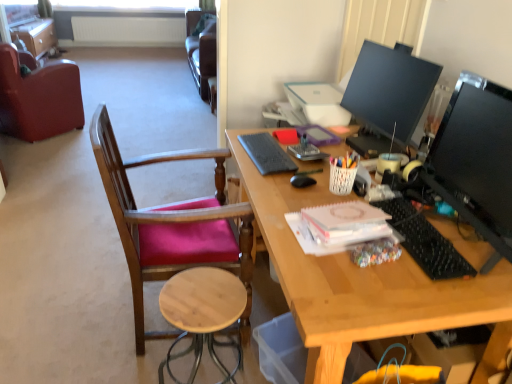
Question: From the image's perspective, is pink paper notepad at center, arranged as the 1th notepad when ordered from the bottom, located above or below matte brown file cabinet at upper left?

Choices:
 (A) above
 (B) below

Answer: (B)

Question: From a real-world perspective, is pink paper notepad at center, placed as the 1th notepad when sorted from front to back, positioned above or below matte brown file cabinet at upper left?

Choices:
 (A) below
 (B) above

Answer: (B)

Question: Which object is positioned closest to the gray matte keyboard at center, the first notepad in the top-to-bottom sequence?

Choices:
 (A) natural wood stool at lower center
 (B) black glossy monitor at right, marked as the 2th television in a back-to-front arrangement
 (C) matte black monitor at upper right, which is counted as the first television, starting from the back
 (D) leather at left, the second chair in the right-to-left sequence
 (E) matte brown file cabinet at upper left

Answer: (C)

Question: Which object is positioned farthest from the leather at left, which is the 1th chair in top-to-bottom order?

Choices:
 (A) pink paper notepad at center, which ranks as the 2th notepad in top-to-bottom order
 (B) gray matte keyboard at center, marked as the first notepad in a back-to-front arrangement
 (C) matte brown file cabinet at upper left
 (D) wooden chair with pink cushion at left, the 2th chair viewed from the top
 (E) black plastic keyboard at right

Answer: (E)